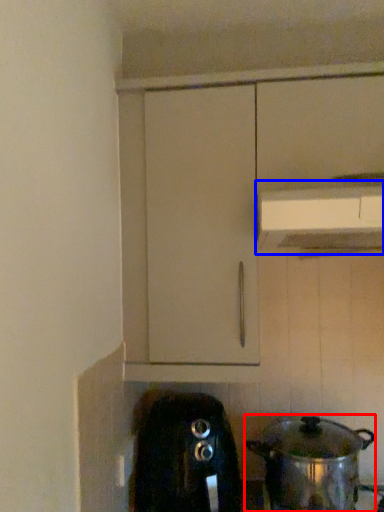
Question: Which object is closer to the camera taking this photo, kitchen appliance (highlighted by a red box) or vent (highlighted by a blue box)?

Choices:
 (A) kitchen appliance
 (B) vent

Answer: (B)